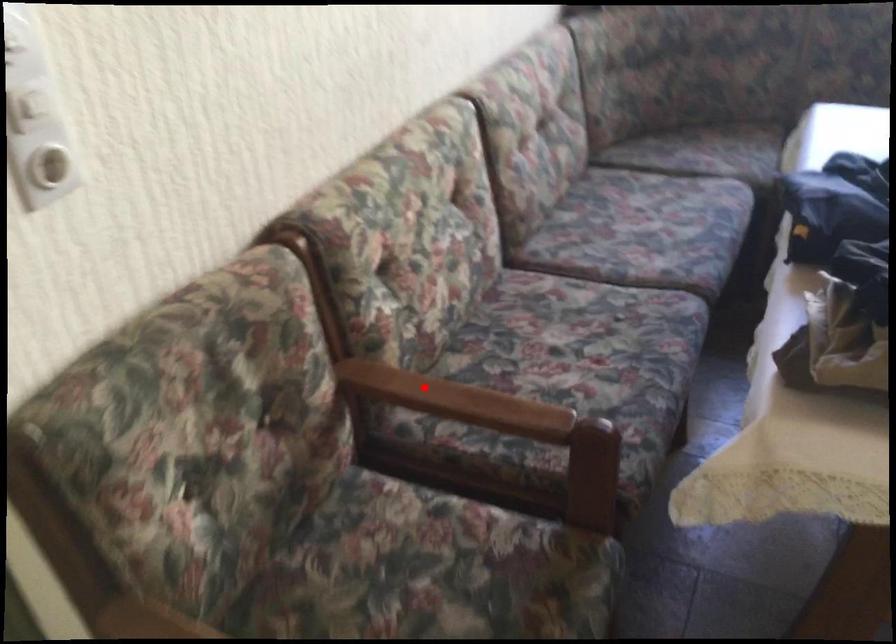
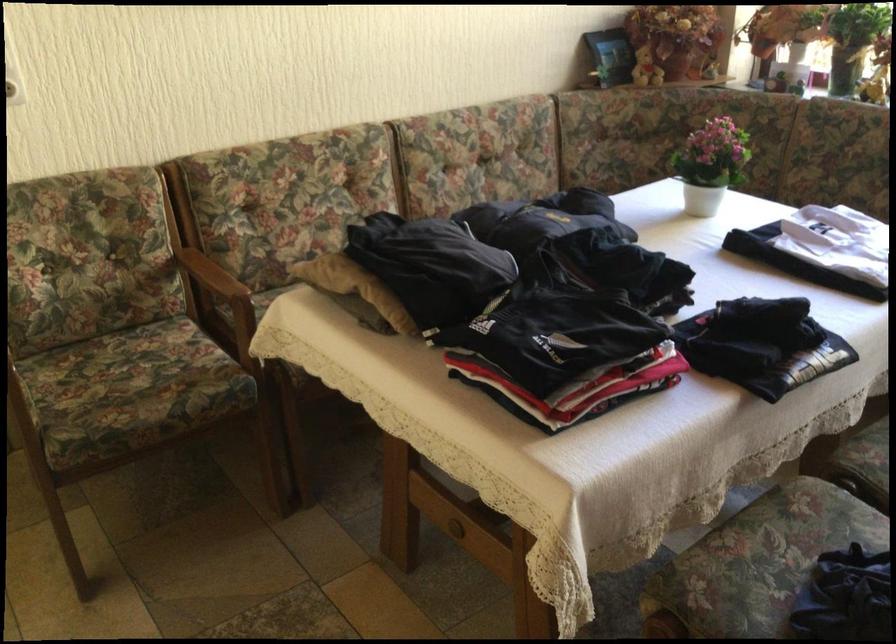
Question: I am providing you with two images of the same scene from different viewpoints. A red point is marked on the first image. At the location where the point appears in image 1, is it still visible in image 2?

Choices:
 (A) Yes
 (B) No

Answer: (A)